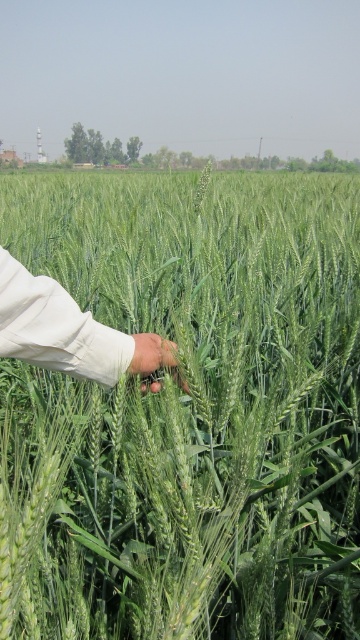
You are a farmer checking the growth of your crops. You notice the green matte wheat at center and the light beige fabric hand at center in the image. Which object is taller?

The green matte wheat at center is taller than the light beige fabric hand at center according to the description.

You are standing in a wheat field and see the green matte wheat at center and the light beige fabric hand at center. Which object is positioned to the left?

The green matte wheat at center is to the left of the light beige fabric hand at center.

You are standing in a wheat field and want to place a small marker exactly at the center of the green matte wheat at center. According to the coordinates provided, where should you place the marker?

The marker should be placed at the coordinates point (189, 412) where the green matte wheat at center is located.